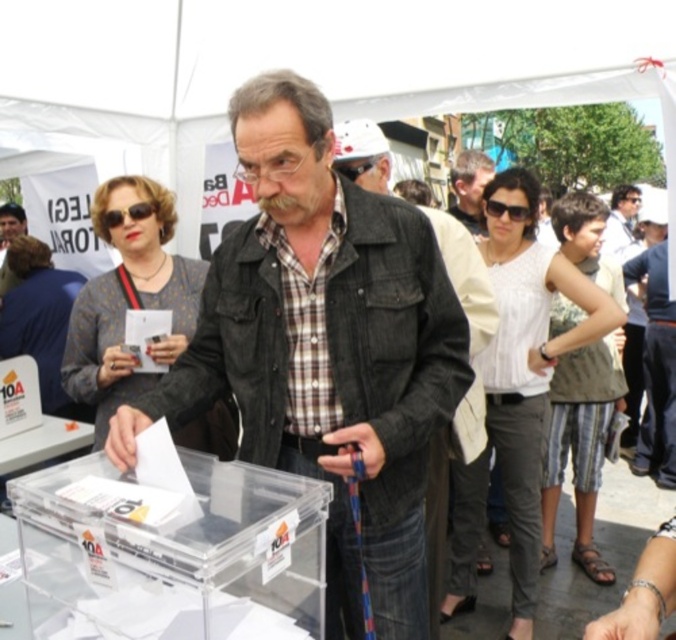
You are a photographer at the voting booth. You need to capture a photo of the voter wearing both the denim jacket at center and the gray fabric shirt at center. Which one should you focus on first to ensure both are in the frame?

The denim jacket at center is to the left of gray fabric shirt at center, so you should focus on the denim jacket at center first to ensure both are in the frame.

You are standing at the ballot box labeled 10A and need to determine the shortest path to exit the voting area. There are two points marked on the ground in front of you. One is at coordinate point [251,116] and the other is at point [450,211]. Which point is closer to you and should you choose for a quicker exit?

Point [251,116] is closer to the viewer than point [450,211], so you should choose point [251,116] for a quicker exit.